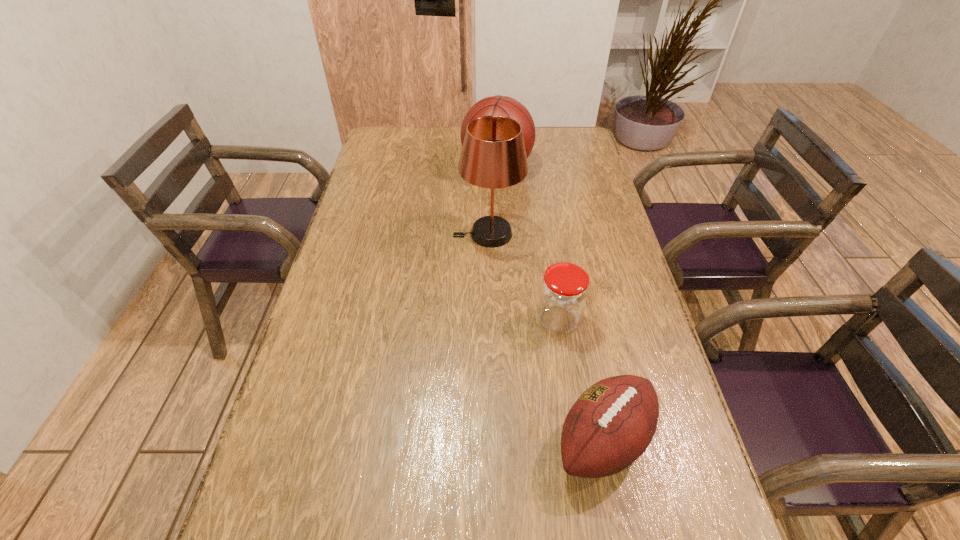
The width and height of the screenshot is (960, 540). I want to click on the tallest object, so click(x=493, y=155).

What are the coordinates of `the second farthest object` in the screenshot? It's located at (493, 155).

This screenshot has height=540, width=960. I want to click on the farthest object, so click(498, 105).

You are a GUI agent. You are given a task and a screenshot of the screen. Output one action in this format:
    pyautogui.click(x=<x>, y=<y>)
    Task: Click on the third shortest object
    This screenshot has width=960, height=540.
    Given the screenshot: What is the action you would take?
    pyautogui.click(x=498, y=105)

Locate an element on the screen. This screenshot has height=540, width=960. jar is located at coordinates (564, 290).

Image resolution: width=960 pixels, height=540 pixels. I want to click on football (American), so click(x=612, y=423).

Locate an element on the screen. The image size is (960, 540). vacant space positioned on the front-facing side of the tallest object is located at coordinates (372, 234).

This screenshot has width=960, height=540. I want to click on blank space located on the front-facing side of the tallest object, so click(387, 234).

This screenshot has height=540, width=960. I want to click on free space located on the front-facing side of the tallest object, so click(362, 234).

This screenshot has height=540, width=960. Identify the location of blank space located on the front of the third shortest object. (500, 232).